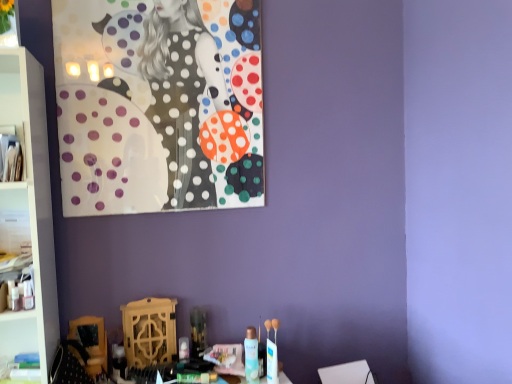
Where is `translucent plastic spray can at center`? This screenshot has width=512, height=384. translucent plastic spray can at center is located at coordinates (251, 356).

This screenshot has width=512, height=384. Identify the location of white plastic cabinet at left, which is counted as the 1th cabinet, starting from the front. (x=12, y=153).

Where is `translucent plastic spray can at center`? This screenshot has width=512, height=384. translucent plastic spray can at center is located at coordinates (251, 356).

Which object is closer to the camera taking this photo, polished glass painting at upper left or translucent plastic bottle at lower center?

translucent plastic bottle at lower center is in front.

Does polished glass painting at upper left appear on the left side of translucent plastic bottle at lower center?

Yes.

Is polished glass painting at upper left taller or shorter than translucent plastic bottle at lower center?

Clearly, polished glass painting at upper left is taller compared to translucent plastic bottle at lower center.

Which is further, (174, 109) or (271, 353)?

The point (174, 109) is farther from the camera.

Which is in front, translucent plastic bottle at lower center or white plastic cabinet at left, which is the 2th cabinet from bottom to top?

white plastic cabinet at left, which is the 2th cabinet from bottom to top, is closer to the camera.

Does translucent plastic bottle at lower center contain white plastic cabinet at left, which ranks as the 2th cabinet in back-to-front order?

Actually, white plastic cabinet at left, which ranks as the 2th cabinet in back-to-front order, is outside translucent plastic bottle at lower center.

How many degrees apart are the facing directions of translucent plastic bottle at lower center and white plastic cabinet at left, which is counted as the 1th cabinet, starting from the front?

The angle between the facing direction of translucent plastic bottle at lower center and the facing direction of white plastic cabinet at left, which is counted as the 1th cabinet, starting from the front, is 3.09 degrees.

Between translucent plastic bottle at lower center and white glossy cabinet at left, which ranks as the 2th cabinet in front-to-back order, which one appears on the right side from the viewer's perspective?

Positioned to the right is translucent plastic bottle at lower center.

Would you say translucent plastic bottle at lower center is inside or outside white glossy cabinet at left, the first cabinet in the bottom-to-top sequence?

translucent plastic bottle at lower center lies outside white glossy cabinet at left, the first cabinet in the bottom-to-top sequence.

Is translucent plastic bottle at lower center with white glossy cabinet at left, which is counted as the first cabinet, starting from the back?

translucent plastic bottle at lower center is not next to white glossy cabinet at left, which is counted as the first cabinet, starting from the back, and they're not touching.

Can you tell me how much translucent plastic bottle at lower center and white glossy cabinet at left, the first cabinet in the bottom-to-top sequence, differ in facing direction?

The angular difference between translucent plastic bottle at lower center and white glossy cabinet at left, the first cabinet in the bottom-to-top sequence, is 1.41 degrees.

Locate an element on the screen. The image size is (512, 384). toy in front of the translucent plastic spray can at center is located at coordinates (272, 352).

Which of these two, translucent plastic spray can at center or translucent plastic bottle at lower center, is bigger?

With larger size is translucent plastic spray can at center.

Considering the positions of point (248, 339) and point (266, 328), is point (248, 339) closer or farther from the camera than point (266, 328)?

Point (248, 339) is closer to the camera than point (266, 328).

Is translucent plastic spray can at center positioned far away from translucent plastic bottle at lower center?

No, translucent plastic spray can at center is not far away from translucent plastic bottle at lower center.

Is white glossy cabinet at left, which is counted as the first cabinet, starting from the back, not inside translucent plastic spray can at center?

Yes.

Between white glossy cabinet at left, which ranks as the 2th cabinet in front-to-back order, and translucent plastic spray can at center, which one is positioned behind?

translucent plastic spray can at center is further from the camera.

Can you confirm if white glossy cabinet at left, which is counted as the first cabinet, starting from the back, is taller than translucent plastic spray can at center?

Correct, white glossy cabinet at left, which is counted as the first cabinet, starting from the back, is much taller as translucent plastic spray can at center.

How many degrees apart are the facing directions of white plastic cabinet at left, which is counted as the 1th cabinet, starting from the front, and polished glass painting at upper left?

There is a 3.09-degree angle between the facing directions of white plastic cabinet at left, which is counted as the 1th cabinet, starting from the front, and polished glass painting at upper left.

Does white plastic cabinet at left, which is the 2th cabinet from bottom to top, have a larger size compared to polished glass painting at upper left?

Actually, white plastic cabinet at left, which is the 2th cabinet from bottom to top, might be smaller than polished glass painting at upper left.

Considering the positions of objects white plastic cabinet at left, which is counted as the 1th cabinet, starting from the front, and polished glass painting at upper left in the image provided, who is behind, white plastic cabinet at left, which is counted as the 1th cabinet, starting from the front, or polished glass painting at upper left?

polished glass painting at upper left is further from the camera.

In order to click on picture frame located behind the white plastic cabinet at left, marked as the first cabinet in a top-to-bottom arrangement in this screenshot , I will do point(159,105).

From the picture: Which point is more forward, [275,320] or [254,365]?

The point [254,365] is in front.

Considering the relative positions of translucent plastic bottle at lower center and translucent plastic spray can at center in the image provided, is translucent plastic bottle at lower center to the right of translucent plastic spray can at center from the viewer's perspective?

Yes.

How different are the orientations of translucent plastic bottle at lower center and translucent plastic spray can at center in degrees?

The angle between the facing direction of translucent plastic bottle at lower center and the facing direction of translucent plastic spray can at center is 0.000721 degrees.

How much distance is there between translucent plastic bottle at lower center and translucent plastic spray can at center?

translucent plastic bottle at lower center and translucent plastic spray can at center are 6.10 centimeters apart.

Find the location of a particular element. This screenshot has width=512, height=384. toy on the right of polished glass painting at upper left is located at coordinates (272, 352).

In the image, there is a white plastic cabinet at left, which is counted as the 1th cabinet, starting from the front. Where is `toy below it (from a real-world perspective)`? toy below it (from a real-world perspective) is located at coordinates (272, 352).

Based on their spatial positions, is white glossy cabinet at left, which ranks as the 2th cabinet in front-to-back order, or white plastic cabinet at left, which ranks as the 2th cabinet in back-to-front order, closer to polished glass painting at upper left?

white glossy cabinet at left, which ranks as the 2th cabinet in front-to-back order.

Looking at the image, which one is located closer to white plastic cabinet at left, which is counted as the 1th cabinet, starting from the front, translucent plastic spray can at center or translucent plastic bottle at lower center?

translucent plastic spray can at center.

Considering their positions, is white glossy cabinet at left, which ranks as the 2th cabinet in front-to-back order, positioned closer to translucent plastic bottle at lower center than translucent plastic spray can at center?

translucent plastic spray can at center lies closer to translucent plastic bottle at lower center than the other object.

When comparing their distances from translucent plastic spray can at center, does polished glass painting at upper left or white glossy cabinet at left, which is counted as the first cabinet, starting from the back, seem closer?

white glossy cabinet at left, which is counted as the first cabinet, starting from the back.

Considering their positions, is translucent plastic spray can at center positioned further to polished glass painting at upper left than translucent plastic bottle at lower center?

Based on the image, translucent plastic bottle at lower center appears to be further to polished glass painting at upper left.

When comparing their distances from translucent plastic bottle at lower center, does translucent plastic spray can at center or white glossy cabinet at left, which ranks as the 2th cabinet in front-to-back order, seem further?

white glossy cabinet at left, which ranks as the 2th cabinet in front-to-back order, is further to translucent plastic bottle at lower center.

Looking at the image, which one is located closer to translucent plastic spray can at center, white plastic cabinet at left, which is counted as the 1th cabinet, starting from the front, or polished glass painting at upper left?

polished glass painting at upper left lies closer to translucent plastic spray can at center than the other object.

From the image, which object appears to be nearer to white plastic cabinet at left, marked as the first cabinet in a top-to-bottom arrangement, white glossy cabinet at left, which is counted as the first cabinet, starting from the back, or polished glass painting at upper left?

white glossy cabinet at left, which is counted as the first cabinet, starting from the back, is closer to white plastic cabinet at left, marked as the first cabinet in a top-to-bottom arrangement.

Locate an element on the screen. The width and height of the screenshot is (512, 384). toiletry between white plastic cabinet at left, which is counted as the 1th cabinet, starting from the front, and translucent plastic bottle at lower center, in the horizontal direction is located at coordinates (251, 356).

You are a GUI agent. You are given a task and a screenshot of the screen. Output one action in this format:
    pyautogui.click(x=<x>, y=<y>)
    Task: Click on the cabinet between white glossy cabinet at left, which is counted as the first cabinet, starting from the back, and translucent plastic bottle at lower center, in the horizontal direction
    
    Given the screenshot: What is the action you would take?
    pyautogui.click(x=12, y=153)

The height and width of the screenshot is (384, 512). What are the coordinates of `toiletry between white glossy cabinet at left, which ranks as the 2th cabinet in front-to-back order, and translucent plastic bottle at lower center, in the horizontal direction` in the screenshot? It's located at (251, 356).

You are a GUI agent. You are given a task and a screenshot of the screen. Output one action in this format:
    pyautogui.click(x=<x>, y=<y>)
    Task: Click on the cabinet that lies between polished glass painting at upper left and white glossy cabinet at left, which is the second cabinet from top to bottom, from top to bottom
    
    Given the screenshot: What is the action you would take?
    pyautogui.click(x=12, y=153)